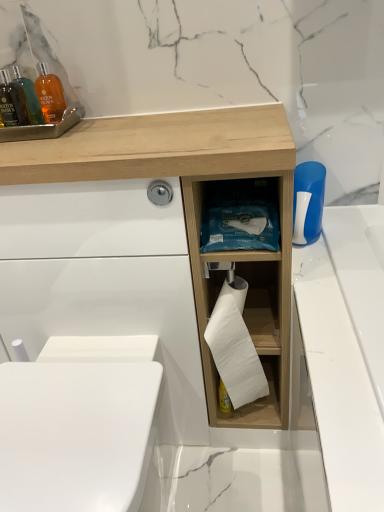
I want to click on vacant area located to the right-hand side of translucent amber bottle at upper left, the 2th mouthwash positioned from the back, so click(x=94, y=126).